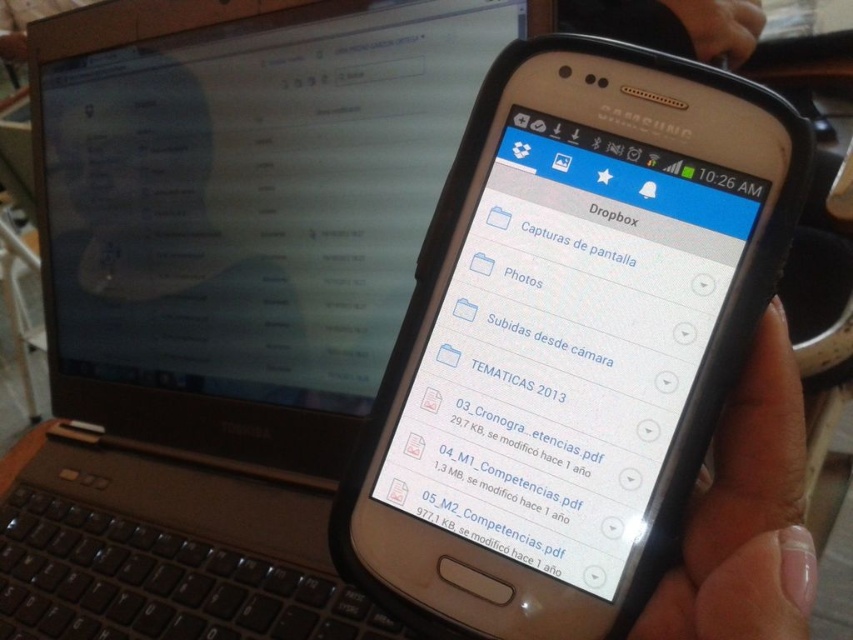
Question: Which of the following is the closest to the observer?

Choices:
 (A) matte black laptop at left
 (B) light skin tone flesh at lower right

Answer: (B)

Question: Does matte black laptop at left have a smaller size compared to light skin tone flesh at lower right?

Choices:
 (A) no
 (B) yes

Answer: (A)

Question: Does matte black laptop at left appear on the right side of light skin tone flesh at lower right?

Choices:
 (A) yes
 (B) no

Answer: (B)

Question: Is matte black laptop at left smaller than light skin tone flesh at lower right?

Choices:
 (A) yes
 (B) no

Answer: (B)

Question: Which of the following is the closest to the observer?

Choices:
 (A) light skin tone flesh at lower right
 (B) matte black laptop at left

Answer: (A)